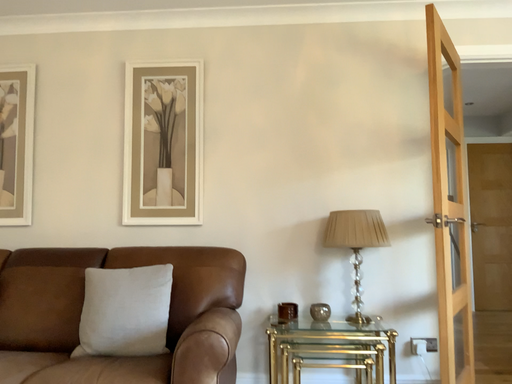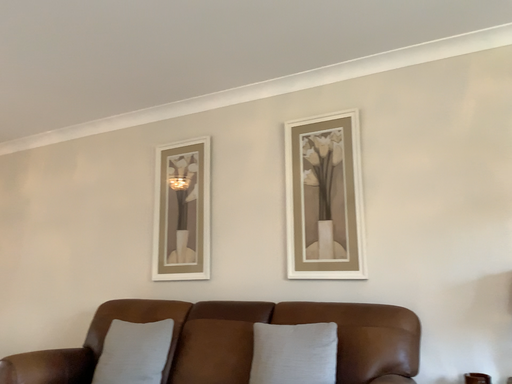
Question: How did the camera likely rotate when shooting the video?

Choices:
 (A) rotated left
 (B) rotated right

Answer: (A)